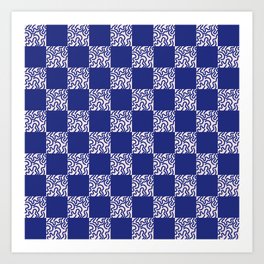
At what (x,y) coordinates should I click in order to perform the action: click on columns. Please return your answer as a coordinate pair (x, y). The height and width of the screenshot is (264, 264). Looking at the image, I should click on coord(37,224), coord(61,225), coord(82,226), coord(100,228), coord(124,228), coord(141,228), coord(205,226), coord(178,230), coord(167,230), coord(228,228).